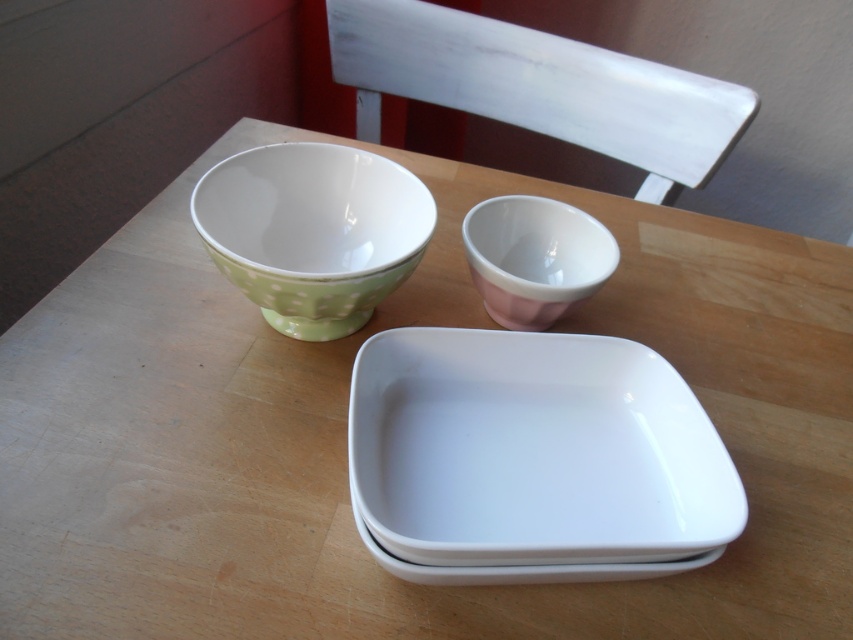
Question: Based on their relative distances, which object is nearer to the green polka dot porcelain bowl at upper left?

Choices:
 (A) white glossy tray at center
 (B) pink glossy cup at upper center

Answer: (B)

Question: Does green polka dot porcelain bowl at upper left have a larger size compared to pink glossy cup at upper center?

Choices:
 (A) no
 (B) yes

Answer: (B)

Question: Estimate the real-world distances between objects in this image. Which object is farther from the white glossy tray at center?

Choices:
 (A) pink glossy cup at upper center
 (B) green polka dot porcelain bowl at upper left

Answer: (B)

Question: Can you confirm if green polka dot porcelain bowl at upper left is smaller than pink glossy cup at upper center?

Choices:
 (A) no
 (B) yes

Answer: (A)

Question: Estimate the real-world distances between objects in this image. Which object is closer to the white glossy tray at center?

Choices:
 (A) pink glossy cup at upper center
 (B) green polka dot porcelain bowl at upper left

Answer: (A)

Question: Considering the relative positions of white glossy tray at center and green polka dot porcelain bowl at upper left in the image provided, where is white glossy tray at center located with respect to green polka dot porcelain bowl at upper left?

Choices:
 (A) below
 (B) above

Answer: (A)